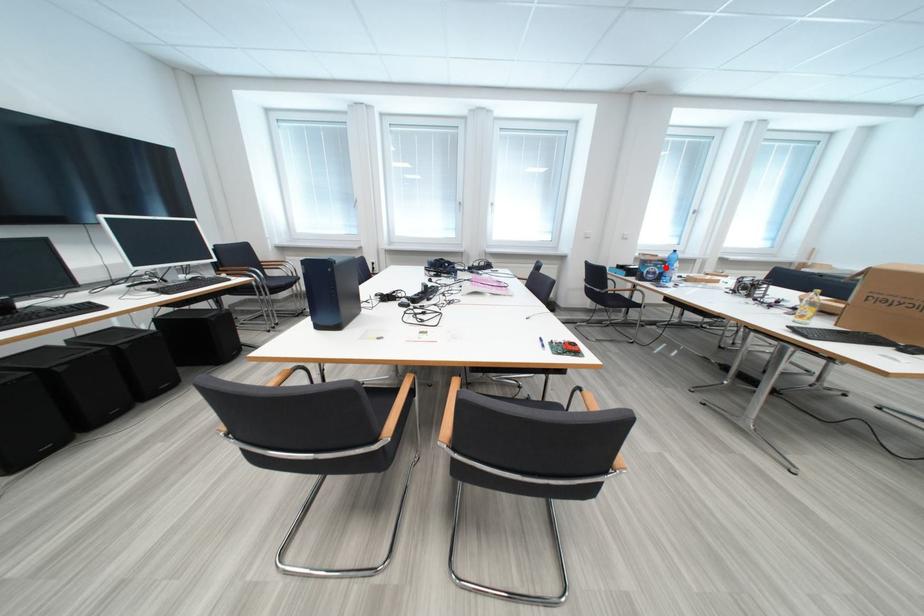
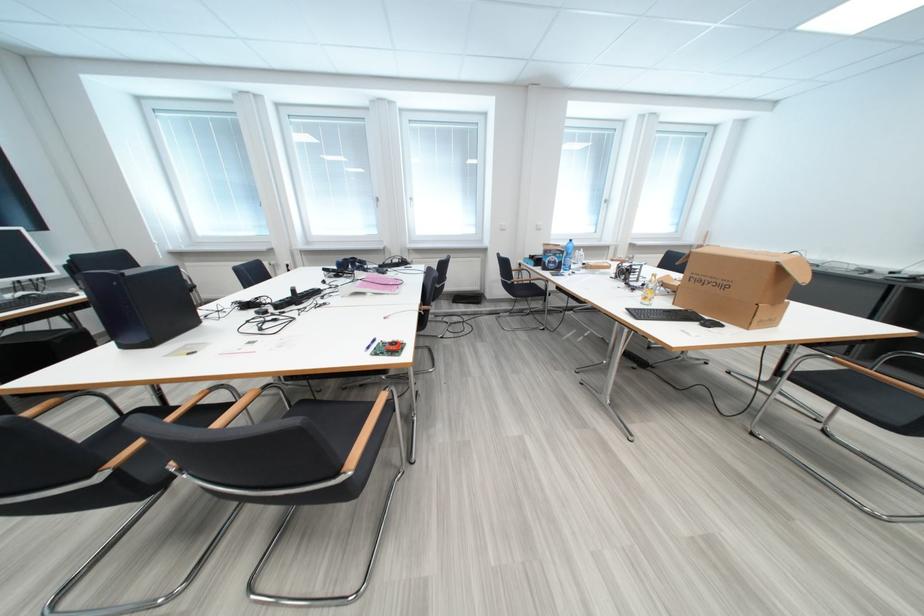
In the second image, find the point that corresponds to the highlighted location in the first image.

(565, 257)